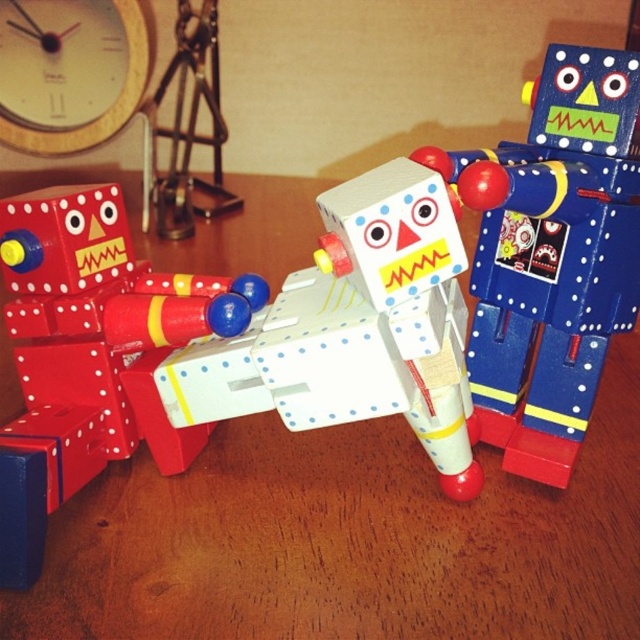
Between point (461, 202) and point (67, 118), which one is positioned in front?

Point (461, 202) is in front.

The image size is (640, 640). What are the coordinates of `blue matte robot at center` in the screenshot? It's located at (552, 253).

Find the location of `blue matte robot at center`. blue matte robot at center is located at coordinates (552, 253).

Who is more forward, (618, 272) or (52, 276)?

Point (52, 276) is more forward.

Does blue matte robot at center lie behind matte wooden robot at left?

No, blue matte robot at center is in front of matte wooden robot at left.

I want to click on blue matte robot at center, so click(x=552, y=253).

Which is more to the right, matte wooden robot at left or wooden clock at upper left?

matte wooden robot at left

Which is in front, point (45, 189) or point (48, 68)?

Point (45, 189)

You are a GUI agent. You are given a task and a screenshot of the screen. Output one action in this format:
    pyautogui.click(x=<x>, y=<y>)
    Task: Click on the matte wooden robot at left
    
    Given the screenshot: What is the action you would take?
    pyautogui.click(x=90, y=353)